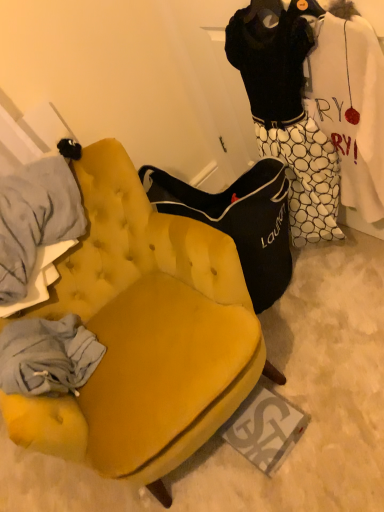
Question: Would you say velvet yellow chair at center is outside black jersey at upper right?

Choices:
 (A) yes
 (B) no

Answer: (A)

Question: From a real-world perspective, is velvet yellow chair at center positioned over black jersey at upper right based on gravity?

Choices:
 (A) yes
 (B) no

Answer: (B)

Question: Is velvet yellow chair at center oriented towards black jersey at upper right?

Choices:
 (A) yes
 (B) no

Answer: (B)

Question: Is black jersey at upper right at the back of velvet yellow chair at center?

Choices:
 (A) yes
 (B) no

Answer: (B)

Question: Can you confirm if velvet yellow chair at center is taller than black jersey at upper right?

Choices:
 (A) no
 (B) yes

Answer: (A)

Question: Is velvet yellow chair at center to the left of black jersey at upper right from the viewer's perspective?

Choices:
 (A) no
 (B) yes

Answer: (B)

Question: Does black jersey at upper right have a larger size compared to velvet yellow chair at center?

Choices:
 (A) no
 (B) yes

Answer: (A)

Question: Are black jersey at upper right and velvet yellow chair at center far apart?

Choices:
 (A) yes
 (B) no

Answer: (B)

Question: Considering the relative sizes of black jersey at upper right and velvet yellow chair at center in the image provided, is black jersey at upper right thinner than velvet yellow chair at center?

Choices:
 (A) yes
 (B) no

Answer: (A)

Question: From the image's perspective, is black jersey at upper right on top of velvet yellow chair at center?

Choices:
 (A) yes
 (B) no

Answer: (A)

Question: Does black jersey at upper right touch velvet yellow chair at center?

Choices:
 (A) yes
 (B) no

Answer: (B)

Question: Does black jersey at upper right turn towards velvet yellow chair at center?

Choices:
 (A) yes
 (B) no

Answer: (A)

Question: In the image, is black jersey at upper right on the left side or the right side of velvet yellow chair at center?

Choices:
 (A) right
 (B) left

Answer: (A)